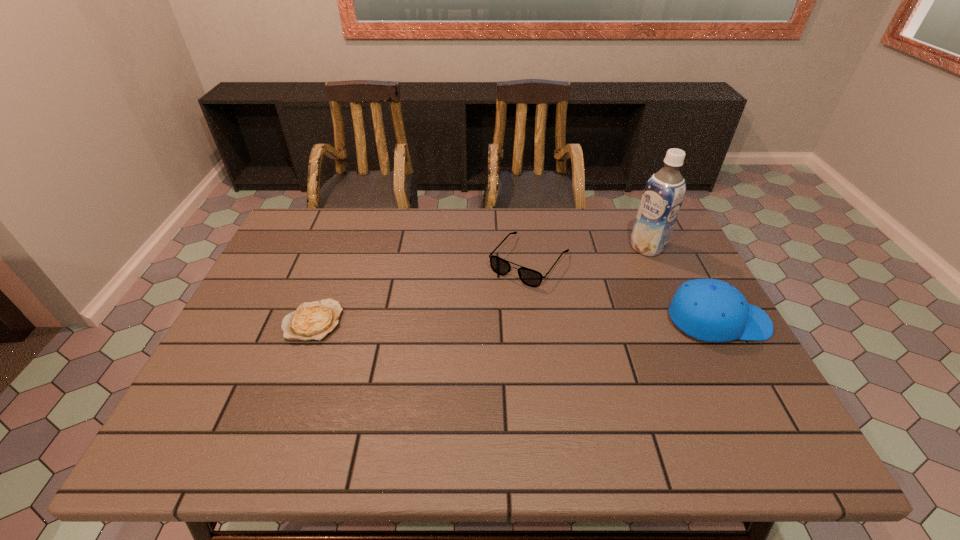
In the image, there is a desktop. At what (x,y) coordinates should I click in order to perform the action: click on blank space at the near edge. Please return your answer as a coordinate pair (x, y). The image size is (960, 540). Looking at the image, I should click on (346, 386).

Find the location of a particular element. The image size is (960, 540). free space at the left edge of the desktop is located at coordinates (283, 255).

Find the location of `free space at the right edge of the desktop`. free space at the right edge of the desktop is located at coordinates click(654, 281).

In the image, there is a desktop. In order to click on free region at the far right corner in this screenshot , I will do `click(629, 222)`.

Where is `vacant area between the cap and the quiche`? The image size is (960, 540). vacant area between the cap and the quiche is located at coordinates point(516,321).

At what (x,y) coordinates should I click in order to perform the action: click on vacant space that's between the soya milk and the leftmost object. Please return your answer as a coordinate pair (x, y). The height and width of the screenshot is (540, 960). Looking at the image, I should click on (480, 284).

Where is `free point between the quiche and the tallest object`? The width and height of the screenshot is (960, 540). free point between the quiche and the tallest object is located at coordinates (480, 284).

Where is `free space between the second tallest object and the third tallest object`? The height and width of the screenshot is (540, 960). free space between the second tallest object and the third tallest object is located at coordinates (624, 291).

Find the location of a particular element. This screenshot has width=960, height=540. vacant point located between the third tallest object and the cap is located at coordinates (624, 291).

Where is `free spot between the leftmost object and the second tallest object`? Image resolution: width=960 pixels, height=540 pixels. free spot between the leftmost object and the second tallest object is located at coordinates (516, 321).